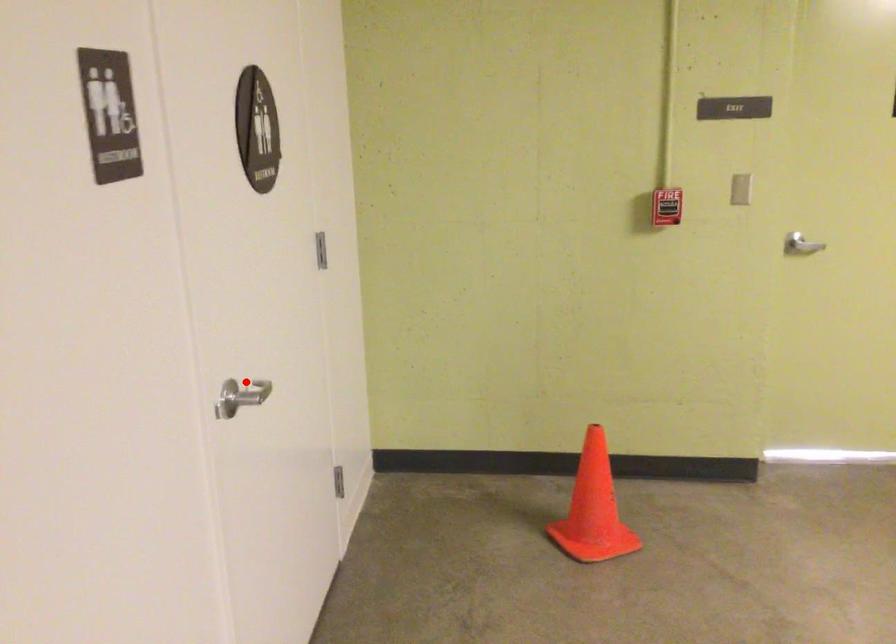
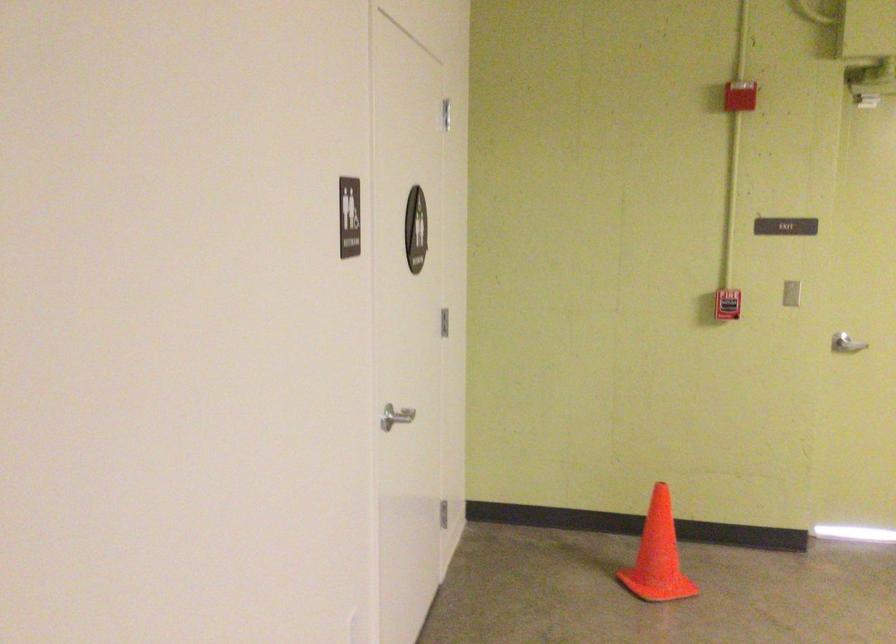
Where in the second image is the point corresponding to the highlighted location from the first image?

(394, 415)